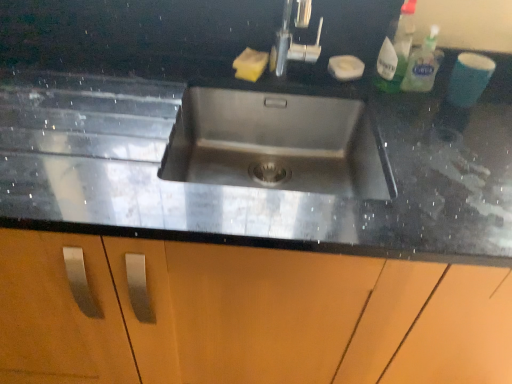
You are a GUI agent. You are given a task and a screenshot of the screen. Output one action in this format:
    pyautogui.click(x=<x>, y=<y>)
    Task: Click on the empty space that is to the right of yellow sponge at upper center, acting as the second soap starting from the right
    This screenshot has width=512, height=384.
    Given the screenshot: What is the action you would take?
    pyautogui.click(x=296, y=71)